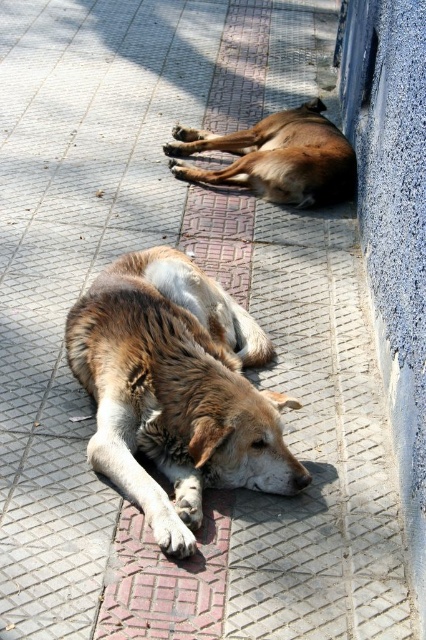
Is brown fur dog at center shorter than brown furry dog at center?

Incorrect, brown fur dog at center's height does not fall short of brown furry dog at center's.

In the scene shown: Does brown fur dog at center have a larger size compared to brown furry dog at center?

Indeed, brown fur dog at center has a larger size compared to brown furry dog at center.

Is point (72, 356) positioned after point (265, 180)?

No, (72, 356) is in front of (265, 180).

Identify the location of brown fur dog at center. (175, 390).